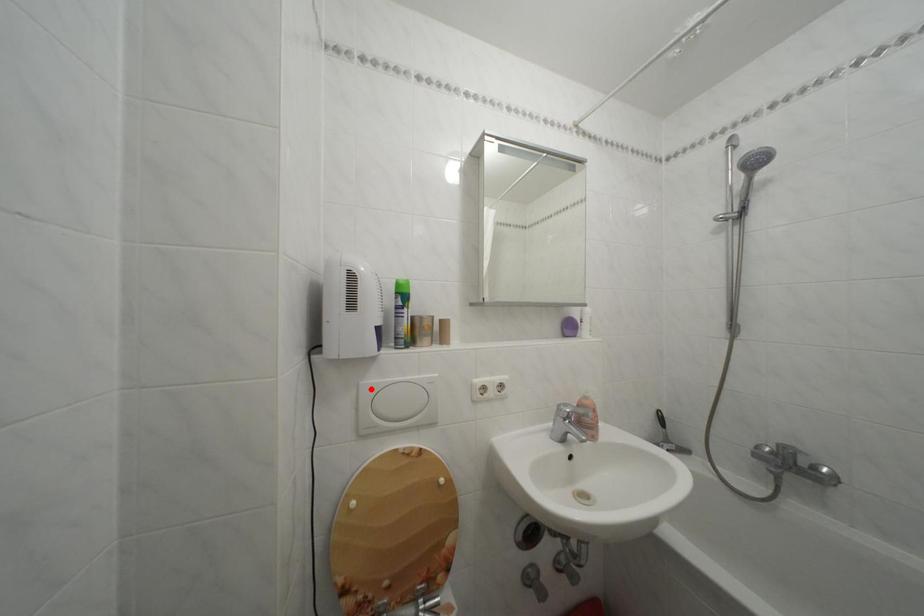
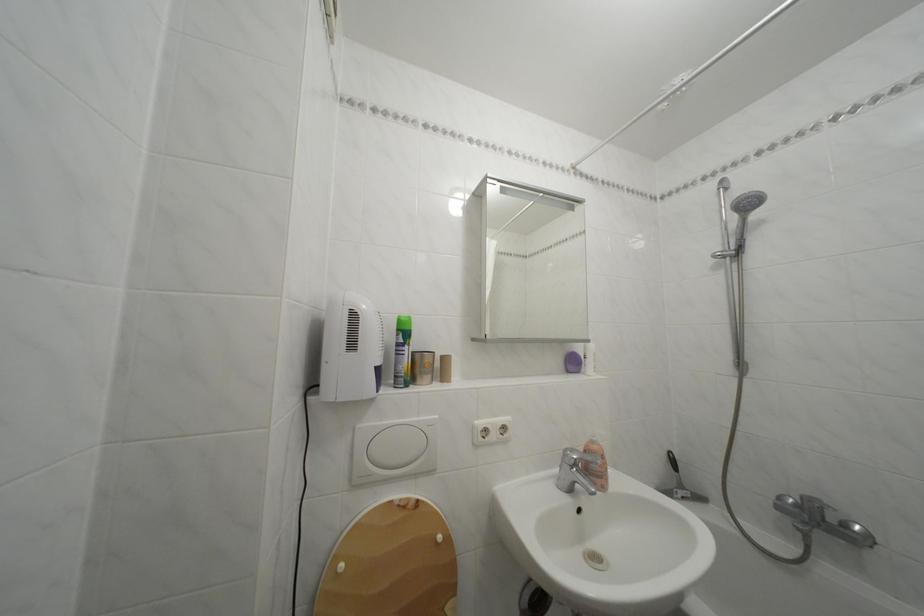
The point at the highlighted location is marked in the first image. Where is the corresponding point in the second image?

(368, 432)